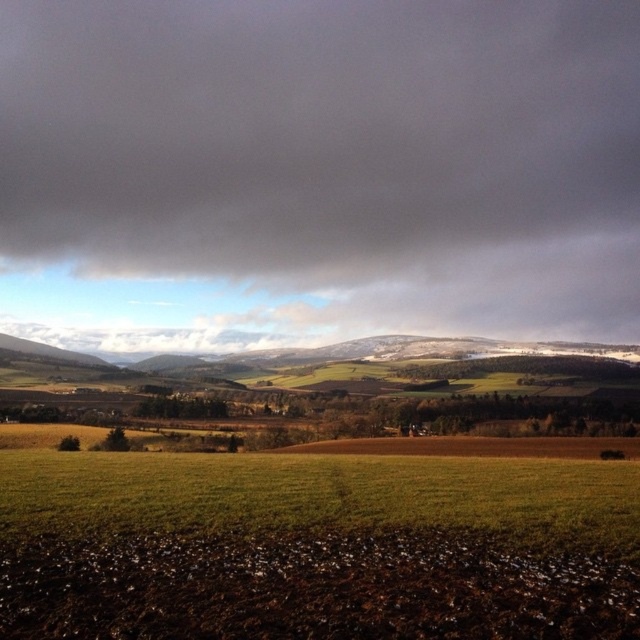
What is the exact location of the dark gray cloud at upper center in the image?

The dark gray cloud at upper center is located at point coordinates of (317, 170).

You are a weather balloon operator who needs to launch a balloon that can ascend up to 1500 feet. Based on the scene, will your balloon be able to reach the dark gray cloud at upper center?

The dark gray cloud at upper center is 1632.87 feet away from the camera, so the balloon cannot reach it since its maximum altitude is 1500 feet.